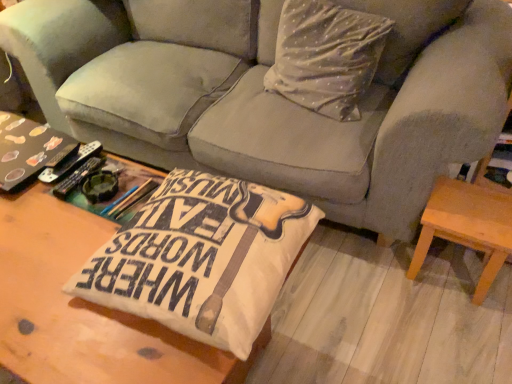
Question: Can you confirm if velvet gray couch at center is smaller than wooden coffee table at center, the 1th table from the left?

Choices:
 (A) yes
 (B) no

Answer: (B)

Question: From the image's perspective, does velvet gray couch at center appear lower than wooden coffee table at center, which is counted as the second table, starting from the right?

Choices:
 (A) no
 (B) yes

Answer: (A)

Question: Does velvet gray couch at center have a larger size compared to wooden coffee table at center, which is counted as the second table, starting from the right?

Choices:
 (A) no
 (B) yes

Answer: (B)

Question: Does velvet gray couch at center lie behind wooden coffee table at center, the 1th table from the left?

Choices:
 (A) no
 (B) yes

Answer: (B)

Question: Is velvet gray couch at center to the left of wooden coffee table at center, which is counted as the second table, starting from the right, from the viewer's perspective?

Choices:
 (A) yes
 (B) no

Answer: (B)

Question: In the image, is velvet gray couch at center positioned in front of or behind light brown wooden stool at lower right, which appears as the first table when viewed from the back?

Choices:
 (A) front
 (B) behind

Answer: (A)

Question: From the image's perspective, is velvet gray couch at center located above or below light brown wooden stool at lower right, arranged as the 1th table when viewed from the right?

Choices:
 (A) below
 (B) above

Answer: (B)

Question: In terms of width, does velvet gray couch at center look wider or thinner when compared to light brown wooden stool at lower right, which ranks as the 2th table in front-to-back order?

Choices:
 (A) thin
 (B) wide

Answer: (B)

Question: In terms of height, does velvet gray couch at center look taller or shorter compared to light brown wooden stool at lower right, placed as the 2th table when sorted from left to right?

Choices:
 (A) tall
 (B) short

Answer: (A)

Question: Based on their sizes in the image, would you say light brown wooden stool at lower right, placed as the 2th table when sorted from left to right, is bigger or smaller than velvet gray couch at center?

Choices:
 (A) small
 (B) big

Answer: (A)

Question: Is point (411, 276) positioned closer to the camera than point (422, 183)?

Choices:
 (A) farther
 (B) closer

Answer: (A)

Question: Is light brown wooden stool at lower right, placed as the 2th table when sorted from left to right, inside the boundaries of velvet gray couch at center, or outside?

Choices:
 (A) outside
 (B) inside

Answer: (B)

Question: From the image's perspective, relative to velvet gray couch at center, is light brown wooden stool at lower right, arranged as the 1th table when viewed from the right, above or below?

Choices:
 (A) above
 (B) below

Answer: (B)

Question: Is white dotted fabric pillow at upper center taller or shorter than matte black book at left?

Choices:
 (A) tall
 (B) short

Answer: (A)

Question: From the image's perspective, is white dotted fabric pillow at upper center located above or below matte black book at left?

Choices:
 (A) below
 (B) above

Answer: (B)